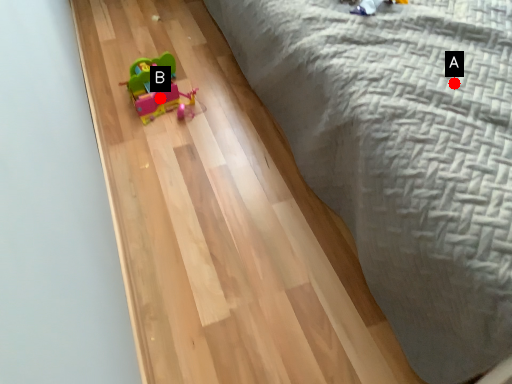
Question: Two points are circled on the image, labeled by A and B beside each circle. Which point is closer to the camera?

Choices:
 (A) A is closer
 (B) B is closer

Answer: (A)